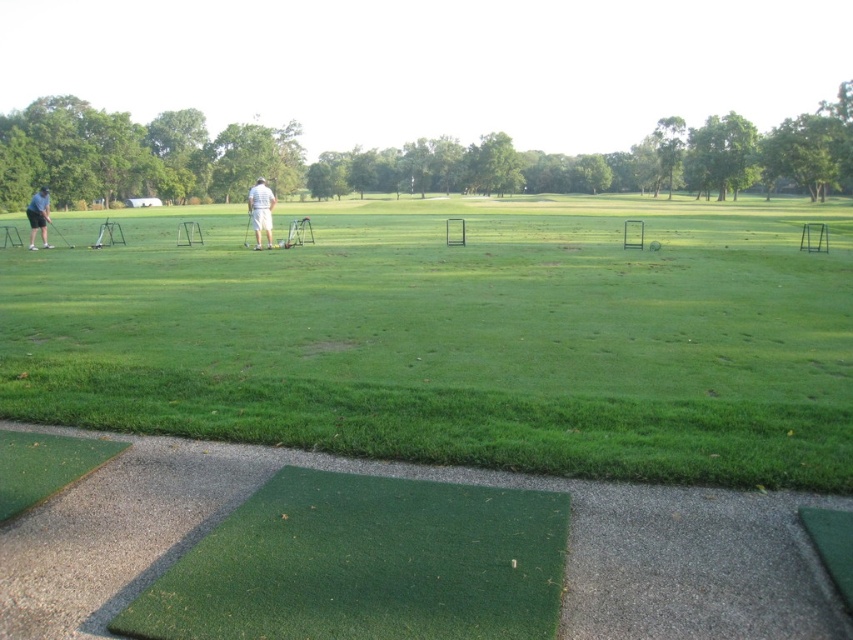
You are at the golf driving range and want to locate the person wearing the light blue shirt at left. According to the coordinates provided, where should you look in the image?

The light blue shirt at left is located at point 0.339 along the horizontal axis and 0.046 along the vertical axis, so you should look towards the left side of the image near the bottom.

You are a golfer standing at the driving range and notice a person wearing a light blue shirt at left and holding a shiny silver golf club at left. Can you determine which object is bigger in the image?

The light blue shirt at left is larger in size than the shiny silver golf club at left.